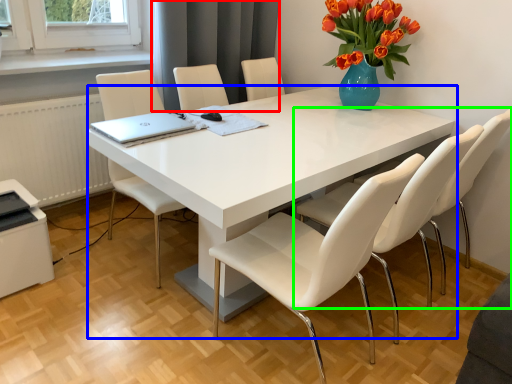
Question: Which is farther away from curtain (highlighted by a red box)? table (highlighted by a blue box) or chair (highlighted by a green box)?

Choices:
 (A) table
 (B) chair

Answer: (B)